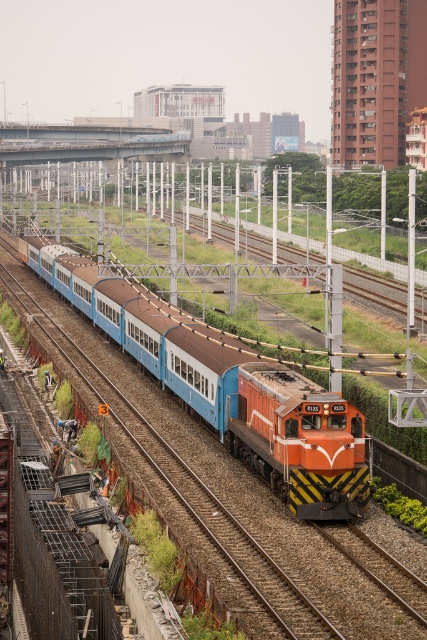
Does orange glossy locomotive at center appear over orange metallic locomotive at center?

Indeed, orange glossy locomotive at center is positioned over orange metallic locomotive at center.

Can you confirm if orange glossy locomotive at center is smaller than orange metallic locomotive at center?

Incorrect, orange glossy locomotive at center is not smaller in size than orange metallic locomotive at center.

Is point (205, 346) more distant than point (274, 477)?

Yes.

Locate an element on the screen. orange glossy locomotive at center is located at coordinates (227, 387).